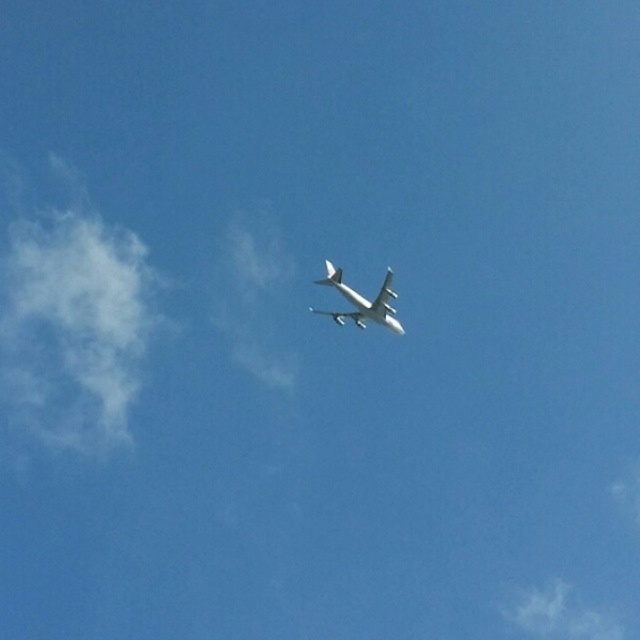
You are a pilot flying a commercial jet and want to avoid turbulence. The white fluffy cloud at upper center is known to cause turbulence. Where should you steer your plane to avoid it?

The white fluffy cloud at upper center is located at point (560,614), so you should steer your plane away from that coordinate to avoid turbulence caused by the cloud.

You are a pilot flying the white matte airplane at center and want to avoid the white fluffy cloud at upper center. In which direction should you steer the plane to move away from the cloud?

The white fluffy cloud at upper center is located to the right of the white matte airplane at center. To move away from the cloud, the pilot should steer the plane to the left.

You are a pilot flying the white matte airplane at center and want to avoid turbulence caused by the white fluffy cloud at left. Given the size difference between them, which object would you need to maneuver around more carefully?

The white fluffy cloud at left is larger than the white matte airplane at center, so you would need to maneuver around the white fluffy cloud at left more carefully to avoid turbulence.